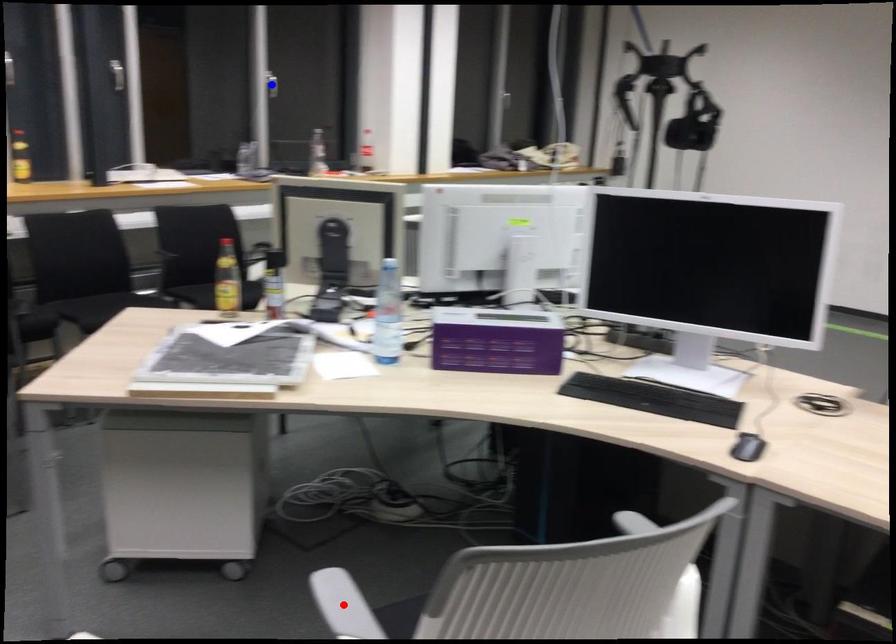
Question: Two points are marked on the image. Which point is closer to the camera?

Choices:
 (A) Blue point is closer.
 (B) Red point is closer.

Answer: (B)